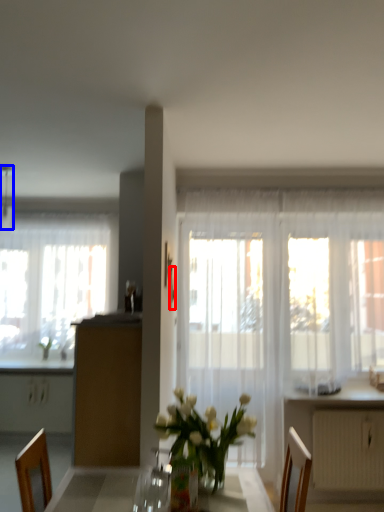
Question: Which object appears farthest to the camera in this image, picture frame (highlighted by a red box) or lamp (highlighted by a blue box)?

Choices:
 (A) picture frame
 (B) lamp

Answer: (B)